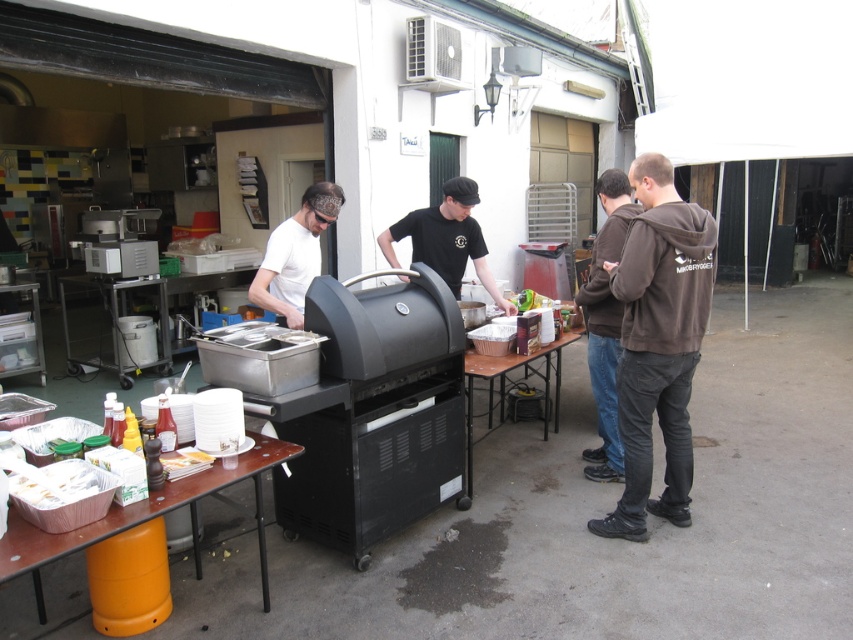
Question: Among these points, which one is nearest to the camera?

Choices:
 (A) (204, 493)
 (B) (413, 218)
 (C) (616, 348)
 (D) (492, 419)

Answer: (A)

Question: Considering the real-world distances, which object is farthest from the brown hoodie at right?

Choices:
 (A) white matte shirt at center
 (B) brown cotton hoodie at center
 (C) wooden table at center

Answer: (A)

Question: Where is brown hoodie at right located in relation to wooden table at center in the image?

Choices:
 (A) left
 (B) right

Answer: (B)

Question: Which object is farther from the camera taking this photo?

Choices:
 (A) brown hoodie at right
 (B) black matte barbecue grill at center
 (C) brown cotton hoodie at center
 (D) wooden table at center

Answer: (A)

Question: Is brown hoodie at right wider than black matte grill at center?

Choices:
 (A) yes
 (B) no

Answer: (B)

Question: Can you confirm if black matte barbecue grill at center is bigger than brown wood table at lower left?

Choices:
 (A) yes
 (B) no

Answer: (A)